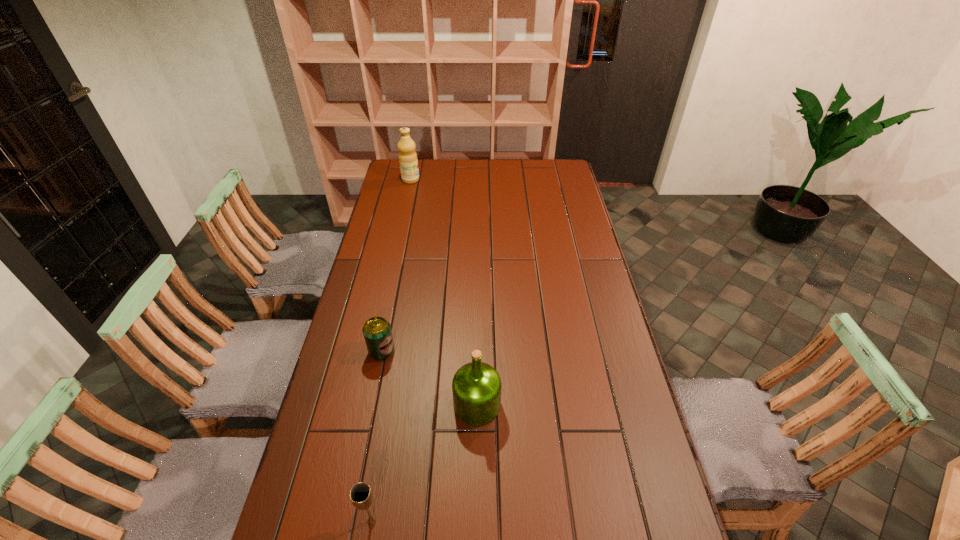
Locate an element on the screen. vacant space situated 0.370m on the back of the third tallest object is located at coordinates (396, 381).

What are the coordinates of `vacant space situated on the right of the third nearest object` in the screenshot? It's located at (460, 351).

This screenshot has height=540, width=960. Find the location of `object that is at the far edge`. object that is at the far edge is located at coordinates (408, 162).

This screenshot has height=540, width=960. In order to click on olive oil that is at the left edge in this screenshot , I will do `click(408, 162)`.

Identify the location of beer can present at the left edge. The image size is (960, 540). (377, 332).

Image resolution: width=960 pixels, height=540 pixels. I want to click on object located in the far left corner section of the desktop, so click(408, 162).

In the image, there is a desktop. Find the location of `vacant space at the far edge`. vacant space at the far edge is located at coordinates (537, 168).

Locate an element on the screen. The image size is (960, 540). free spot at the left edge of the desktop is located at coordinates (329, 455).

In the image, there is a desktop. At what (x,y) coordinates should I click in order to perform the action: click on free region at the right edge. Please return your answer as a coordinate pair (x, y). This screenshot has width=960, height=540. Looking at the image, I should click on (550, 199).

Image resolution: width=960 pixels, height=540 pixels. Identify the location of free spot between the beer can and the farthest object. (396, 266).